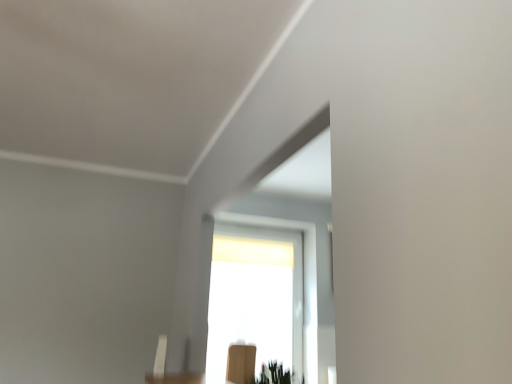
Question: Considering the relative sizes of transparent glass window at center and wooden chair at lower center in the image provided, is transparent glass window at center shorter than wooden chair at lower center?

Choices:
 (A) no
 (B) yes

Answer: (A)

Question: From the image's perspective, does transparent glass window at center appear higher than wooden chair at lower center?

Choices:
 (A) yes
 (B) no

Answer: (A)

Question: Does transparent glass window at center lie behind wooden chair at lower center?

Choices:
 (A) yes
 (B) no

Answer: (A)

Question: Is transparent glass window at center smaller than wooden chair at lower center?

Choices:
 (A) no
 (B) yes

Answer: (A)

Question: Is transparent glass window at center taller than wooden chair at lower center?

Choices:
 (A) yes
 (B) no

Answer: (A)

Question: Is transparent glass window at center thinner than wooden chair at lower center?

Choices:
 (A) no
 (B) yes

Answer: (A)

Question: Considering the relative positions of wooden chair at lower center and green matte plant at lower center in the image provided, is wooden chair at lower center to the right of green matte plant at lower center from the viewer's perspective?

Choices:
 (A) yes
 (B) no

Answer: (B)

Question: From the image's perspective, is wooden chair at lower center located beneath green matte plant at lower center?

Choices:
 (A) no
 (B) yes

Answer: (B)

Question: Is green matte plant at lower center surrounded by wooden chair at lower center?

Choices:
 (A) yes
 (B) no

Answer: (B)

Question: Is wooden chair at lower center bigger than green matte plant at lower center?

Choices:
 (A) yes
 (B) no

Answer: (A)

Question: From a real-world perspective, is wooden chair at lower center physically below green matte plant at lower center?

Choices:
 (A) yes
 (B) no

Answer: (A)

Question: Is wooden chair at lower center to the left of green matte plant at lower center from the viewer's perspective?

Choices:
 (A) yes
 (B) no

Answer: (A)

Question: Considering the relative sizes of transparent glass window at center and green matte plant at lower center in the image provided, is transparent glass window at center shorter than green matte plant at lower center?

Choices:
 (A) yes
 (B) no

Answer: (B)